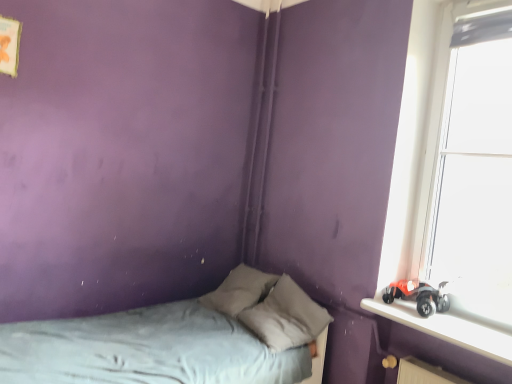
Question: Considering the positions of smooth plastic toy car at right and gray fabric bed at lower left in the image, is smooth plastic toy car at right wider or thinner than gray fabric bed at lower left?

Choices:
 (A) wide
 (B) thin

Answer: (B)

Question: Looking at the image, does smooth plastic toy car at right seem bigger or smaller compared to gray fabric bed at lower left?

Choices:
 (A) small
 (B) big

Answer: (A)

Question: Which object is the closest to the smooth plastic toy car at right?

Choices:
 (A) gray fabric pillow at center
 (B) gray fabric bed at lower left
 (C) transparent glass window at right

Answer: (C)

Question: Which object is positioned closest to the smooth plastic toy car at right?

Choices:
 (A) gray fabric bed at lower left
 (B) gray fabric pillow at center
 (C) transparent glass window at right

Answer: (C)